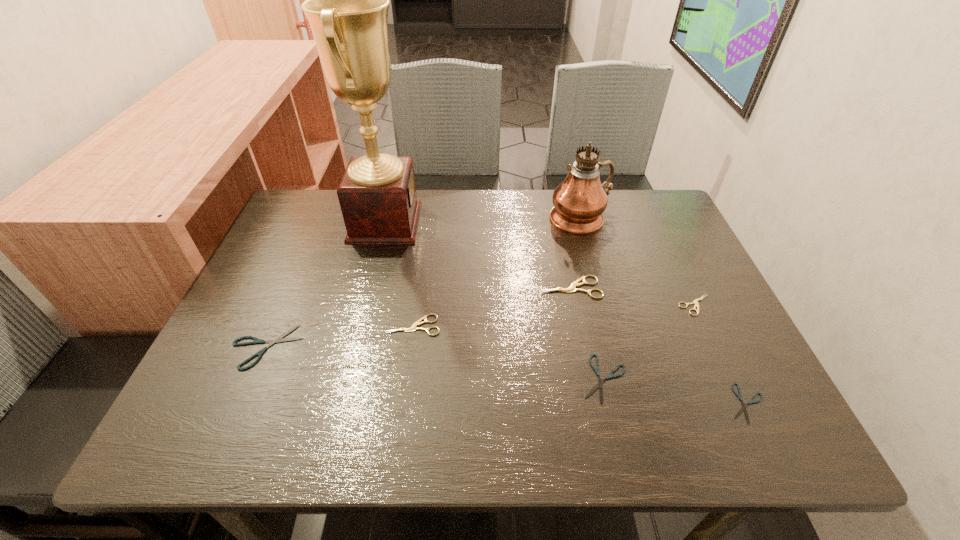
Where is `vacant space in between the rightmost beige shears and the oil lamp`? vacant space in between the rightmost beige shears and the oil lamp is located at coordinates 638,261.

Find the location of a particular element. This screenshot has height=540, width=960. free point between the leftmost object and the biggest beige shears is located at coordinates (419, 317).

Locate an element on the screen. vacant space that is in between the smallest beige shears and the fifth shortest shears is located at coordinates (554, 315).

What are the coordinates of `unoccupied area between the leftmost shears and the trophy cup` in the screenshot? It's located at point(326,285).

The image size is (960, 540). What are the coordinates of `free space between the rightmost beige shears and the rightmost black shears` in the screenshot? It's located at (721, 354).

You are a GUI agent. You are given a task and a screenshot of the screen. Output one action in this format:
    pyautogui.click(x=<x>, y=<y>)
    Task: Click on the vacant area that lies between the trophy cup and the smallest beige shears
    This screenshot has height=540, width=960.
    Given the screenshot: What is the action you would take?
    pyautogui.click(x=540, y=264)

I want to click on unoccupied position between the smallest black shears and the second shears from left to right, so click(580, 364).

What are the coordinates of `free spot between the second shears from left to right and the trophy cup` in the screenshot? It's located at (399, 274).

Where is `free space between the biggest black shears and the second shears from left to right`? This screenshot has width=960, height=540. free space between the biggest black shears and the second shears from left to right is located at coordinates (340, 336).

Where is `free spot between the rightmost beige shears and the biggest black shears`? free spot between the rightmost beige shears and the biggest black shears is located at coordinates (481, 326).